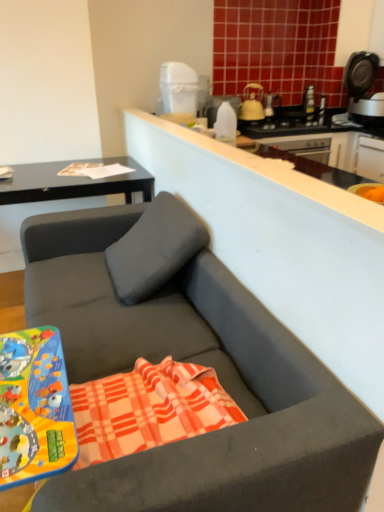
Question: From a real-world perspective, relative to yellow matte kettle at upper center, is white plastic trash can at upper center vertically above or below?

Choices:
 (A) above
 (B) below

Answer: (A)

Question: From the image's perspective, is white plastic trash can at upper center positioned above or below yellow matte kettle at upper center?

Choices:
 (A) below
 (B) above

Answer: (A)

Question: Based on their relative distances, which object is nearer to the plaid cotton beach towel at center?

Choices:
 (A) transparent plastic bottle at upper center
 (B) black plastic coffee machine at upper right
 (C) matte gray studio couch at center
 (D) white plastic trash can at upper center
 (E) metallic plastic game board at lower left

Answer: (E)

Question: Which object is positioned closest to the matte black desk at upper left?

Choices:
 (A) matte gray studio couch at center
 (B) white plastic trash can at upper center
 (C) metallic plastic game board at lower left
 (D) black plastic coffee machine at upper right
 (E) yellow matte kettle at upper center

Answer: (B)